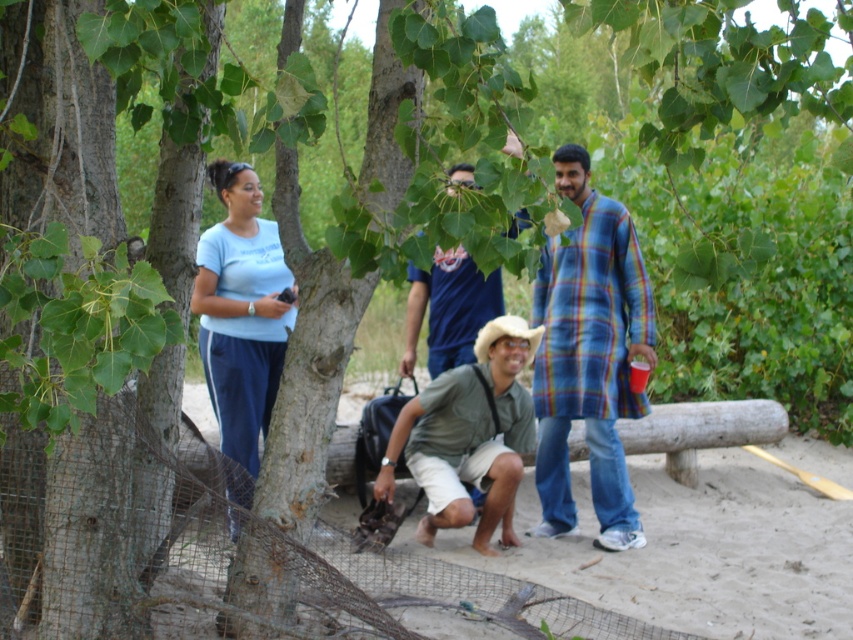
You are organizing a clothing donation drive and need to determine which shirt takes up more space when folded. Based on the image, which of the two shirts, the plaid cotton shirt at right or the blue cotton shirt at center, has a greater width?

The plaid cotton shirt at right has a greater width than the blue cotton shirt at center, so it will take up more space when folded.

Based on the photo, you are standing at the center of the sandy area in the image. Which of the two points, point [461,493] or point [439,364], is nearer to your current position?

Point [461,493] is closer to the camera, so it is nearer to your current position.